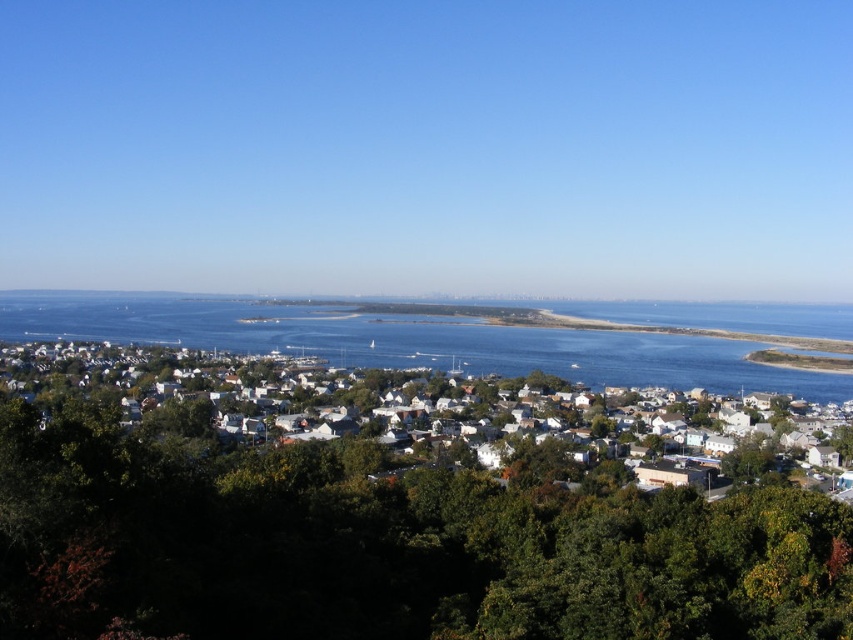
Question: Which point is farther to the camera?

Choices:
 (A) green leafy tree at center
 (B) blue water at center

Answer: (B)

Question: Is white matte houses at center smaller than blue water at center?

Choices:
 (A) yes
 (B) no

Answer: (B)

Question: Can you confirm if green leafy tree at center is positioned to the left of white matte houses at center?

Choices:
 (A) yes
 (B) no

Answer: (A)

Question: Among these objects, which one is farthest from the camera?

Choices:
 (A) green leafy tree at center
 (B) blue water at center
 (C) white matte houses at center

Answer: (B)

Question: Where is green leafy tree at center located in relation to blue water at center in the image?

Choices:
 (A) above
 (B) below

Answer: (B)

Question: Which of the following is the closest to the observer?

Choices:
 (A) white matte houses at center
 (B) green leafy tree at center

Answer: (B)